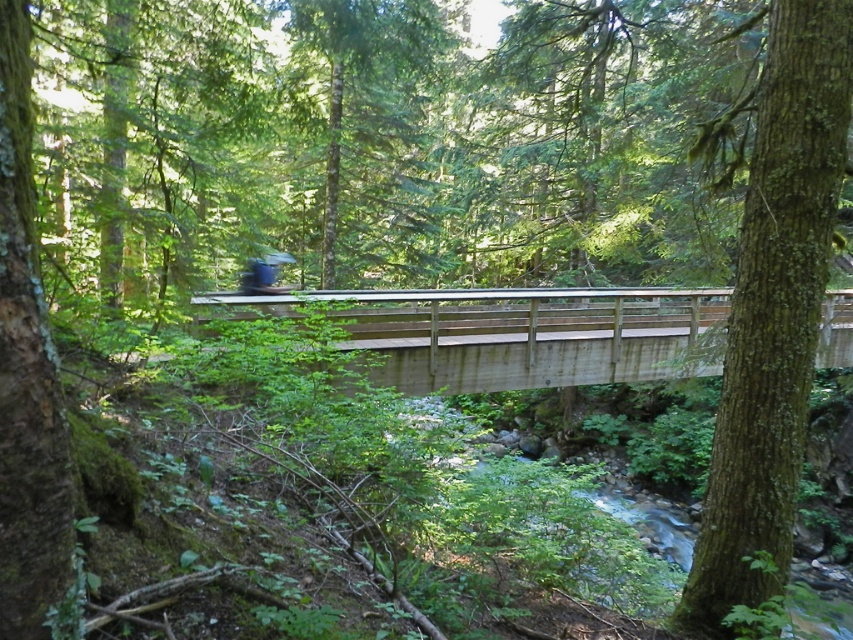
Question: Which of these objects is positioned closest to the green rough bark tree at center?

Choices:
 (A) wooden bridge at center
 (B) green rough bark tree at left

Answer: (B)

Question: Which point is farther from the camera taking this photo?

Choices:
 (A) (788, 92)
 (B) (19, 179)
 (C) (633, 365)

Answer: (C)

Question: Can you confirm if green rough bark tree at center is thinner than green rough bark tree at left?

Choices:
 (A) no
 (B) yes

Answer: (A)

Question: Is the position of green rough bark tree at center less distant than that of wooden bridge at center?

Choices:
 (A) no
 (B) yes

Answer: (B)

Question: Can you confirm if green rough bark tree at center is wider than green rough bark tree at left?

Choices:
 (A) no
 (B) yes

Answer: (B)

Question: Based on their relative distances, which object is farther from the green rough bark tree at left?

Choices:
 (A) wooden bridge at center
 (B) green rough bark tree at center

Answer: (A)